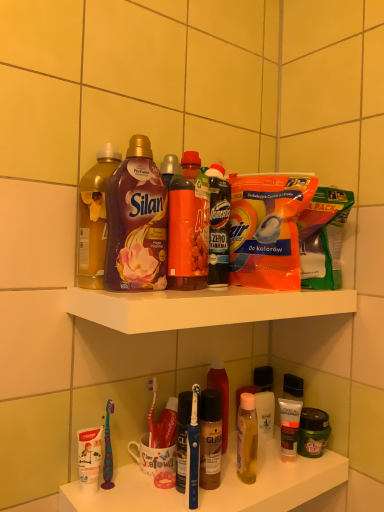
Question: Considering the relative sizes of white glossy bottle at lower center, marked as the 3th toiletry in a front-to-back arrangement, and matte black tube at lower right, the 2th toiletry in the back-to-front sequence, in the image provided, is white glossy bottle at lower center, marked as the 3th toiletry in a front-to-back arrangement, shorter than matte black tube at lower right, the 2th toiletry in the back-to-front sequence,?

Choices:
 (A) yes
 (B) no

Answer: (B)

Question: From the image's perspective, is white glossy bottle at lower center, marked as the 3th toiletry in a front-to-back arrangement, over matte black tube at lower right, the 2th toiletry in the back-to-front sequence?

Choices:
 (A) no
 (B) yes

Answer: (B)

Question: Is white glossy bottle at lower center, the first toiletry positioned from the back, taller than matte black tube at lower right, which is the second toiletry from front to back?

Choices:
 (A) yes
 (B) no

Answer: (A)

Question: Considering the relative sizes of white glossy bottle at lower center, the first toiletry positioned from the back, and matte black tube at lower right, the 2th toiletry in the back-to-front sequence, in the image provided, is white glossy bottle at lower center, the first toiletry positioned from the back, wider than matte black tube at lower right, the 2th toiletry in the back-to-front sequence,?

Choices:
 (A) no
 (B) yes

Answer: (A)

Question: Can you confirm if white glossy bottle at lower center, the first toiletry positioned from the back, is bigger than matte black tube at lower right, which is the second toiletry from front to back?

Choices:
 (A) yes
 (B) no

Answer: (A)

Question: Is translucent plastic bottle at center, which is the 3th bottle in top-to-bottom order, situated inside matte black tube at lower right, the 2th toiletry in the back-to-front sequence, or outside?

Choices:
 (A) inside
 (B) outside

Answer: (B)

Question: From a real-world perspective, relative to matte black tube at lower right, which is the second toiletry from front to back, is translucent plastic bottle at center, which is counted as the 3th bottle, starting from the front, vertically above or below?

Choices:
 (A) above
 (B) below

Answer: (A)

Question: Is translucent plastic bottle at center, which is the 3th bottle in top-to-bottom order, in front of or behind matte black tube at lower right, the 2th toiletry in the back-to-front sequence, in the image?

Choices:
 (A) behind
 (B) front

Answer: (B)

Question: Considering the positions of translucent plastic bottle at center, which ranks as the first bottle in right-to-left order, and matte black tube at lower right, which is the second toiletry from front to back, in the image, is translucent plastic bottle at center, which ranks as the first bottle in right-to-left order, bigger or smaller than matte black tube at lower right, which is the second toiletry from front to back,?

Choices:
 (A) small
 (B) big

Answer: (B)

Question: Is white plastic toothbrushes at lower left situated inside matte black hair mask at lower right, which is the first toiletry from front to back, or outside?

Choices:
 (A) outside
 (B) inside

Answer: (A)

Question: Based on their sizes in the image, would you say white plastic toothbrushes at lower left is bigger or smaller than matte black hair mask at lower right, the third toiletry in the back-to-front sequence?

Choices:
 (A) big
 (B) small

Answer: (A)

Question: In terms of height, does white plastic toothbrushes at lower left look taller or shorter compared to matte black hair mask at lower right, which is the first toiletry from front to back?

Choices:
 (A) tall
 (B) short

Answer: (B)

Question: From the image's perspective, relative to matte black hair mask at lower right, which is the first toiletry from front to back, is white plastic toothbrushes at lower left above or below?

Choices:
 (A) above
 (B) below

Answer: (B)

Question: Is matte purple fabric softener at upper center, which is the 1th bottle in left-to-right order, wider or thinner than white plastic toothbrushes at lower left?

Choices:
 (A) thin
 (B) wide

Answer: (A)

Question: Is point (79, 216) positioned closer to the camera than point (125, 487)?

Choices:
 (A) farther
 (B) closer

Answer: (A)